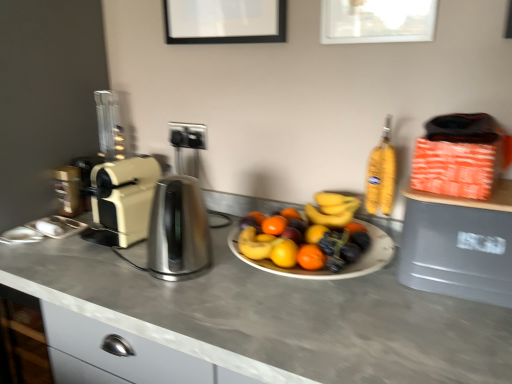
At what (x,y) coordinates should I click in order to perform the action: click on free space in front of gray plastic trash can at right. Please return your answer as a coordinate pair (x, y). The height and width of the screenshot is (384, 512). Looking at the image, I should click on (452, 326).